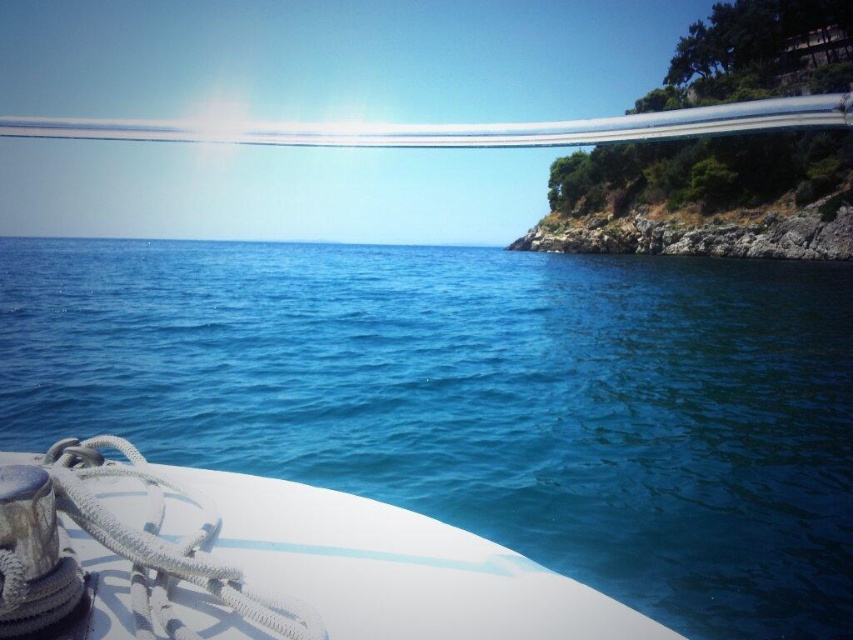
Can you confirm if blue liquid water at center is taller than white matte boat at lower left?

Yes.

Which is behind, point (763, 435) or point (177, 518)?

The point (763, 435) is more distant.

Which is behind, point (236, 339) or point (381, 525)?

Point (236, 339)

Find the location of `blue liquid water at center`. blue liquid water at center is located at coordinates (500, 385).